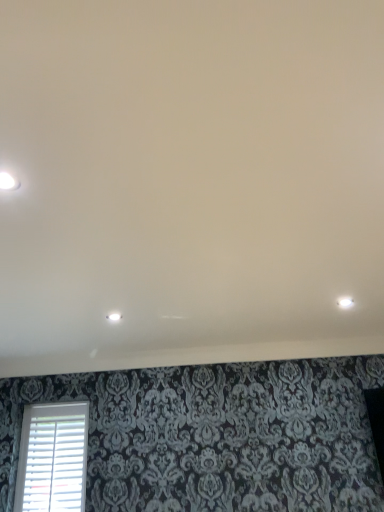
Question: Can you confirm if white plastic blinds at lower left is smaller than white glossy light fixture at center, which is the 1th dot in back-to-front order?

Choices:
 (A) yes
 (B) no

Answer: (B)

Question: Considering the relative sizes of white plastic blinds at lower left and white glossy light fixture at center, the 2th dot when ordered from top to bottom, in the image provided, is white plastic blinds at lower left taller than white glossy light fixture at center, the 2th dot when ordered from top to bottom,?

Choices:
 (A) no
 (B) yes

Answer: (B)

Question: From a real-world perspective, is white plastic blinds at lower left positioned over white glossy light fixture at center, placed as the second dot when sorted from left to right, based on gravity?

Choices:
 (A) no
 (B) yes

Answer: (A)

Question: From the image's perspective, is white plastic blinds at lower left below white glossy light fixture at center, placed as the first dot when sorted from right to left?

Choices:
 (A) no
 (B) yes

Answer: (B)

Question: Considering the relative positions of white plastic blinds at lower left and white glossy light fixture at center, placed as the second dot when sorted from left to right, in the image provided, is white plastic blinds at lower left to the left of white glossy light fixture at center, placed as the second dot when sorted from left to right, from the viewer's perspective?

Choices:
 (A) no
 (B) yes

Answer: (B)

Question: Relative to white matte ceiling at upper center, is white glossy light fixture at upper left, placed as the 1th dot when sorted from left to right, in front or behind?

Choices:
 (A) front
 (B) behind

Answer: (B)

Question: Visually, is white glossy light fixture at upper left, placed as the 1th dot when sorted from left to right, positioned to the left or to the right of white matte ceiling at upper center?

Choices:
 (A) right
 (B) left

Answer: (B)

Question: From the image's perspective, is white glossy light fixture at upper left, acting as the second dot starting from the right, above or below white matte ceiling at upper center?

Choices:
 (A) below
 (B) above

Answer: (B)

Question: In terms of height, does white glossy light fixture at upper left, the 2th dot from the bottom, look taller or shorter compared to white matte ceiling at upper center?

Choices:
 (A) short
 (B) tall

Answer: (A)

Question: Choose the correct answer: Is white glossy light fixture at center, which ranks as the 1th dot in bottom-to-top order, inside white matte ceiling at upper center or outside it?

Choices:
 (A) inside
 (B) outside

Answer: (A)

Question: Considering the positions of white glossy light fixture at center, which ranks as the 1th dot in bottom-to-top order, and white matte ceiling at upper center in the image, is white glossy light fixture at center, which ranks as the 1th dot in bottom-to-top order, bigger or smaller than white matte ceiling at upper center?

Choices:
 (A) small
 (B) big

Answer: (A)

Question: Considering the positions of white glossy light fixture at center, which is the 1th dot in back-to-front order, and white matte ceiling at upper center in the image, is white glossy light fixture at center, which is the 1th dot in back-to-front order, wider or thinner than white matte ceiling at upper center?

Choices:
 (A) thin
 (B) wide

Answer: (A)

Question: From the image's perspective, relative to white matte ceiling at upper center, is white glossy light fixture at center, which is the 1th dot in back-to-front order, above or below?

Choices:
 (A) above
 (B) below

Answer: (B)

Question: Based on their positions, is white plastic blinds at lower left located to the left or right of white matte ceiling at upper center?

Choices:
 (A) right
 (B) left

Answer: (B)

Question: Is white plastic blinds at lower left taller or shorter than white matte ceiling at upper center?

Choices:
 (A) short
 (B) tall

Answer: (B)